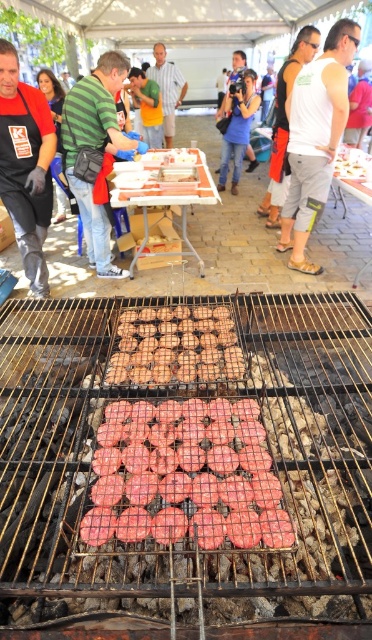
Question: Which point is closer to the camera?

Choices:
 (A) (159, 147)
 (B) (287, 100)
 (C) (78, 113)
 (D) (49, 193)

Answer: (C)

Question: Which point appears farthest from the camera in this image?

Choices:
 (A) (156, 52)
 (B) (245, 419)
 (C) (363, 160)
 (D) (315, 93)

Answer: (A)

Question: Among these points, which one is nearest to the camera?

Choices:
 (A) (245, 60)
 (B) (106, 273)
 (C) (351, 166)
 (D) (268, 176)

Answer: (B)

Question: Observing the image, what is the correct spatial positioning of brushed metal apron at left in reference to white matte tank top at center?

Choices:
 (A) below
 (B) above

Answer: (A)

Question: Is the position of green striped shirt at upper left more distant than that of white glossy plate at center?

Choices:
 (A) no
 (B) yes

Answer: (A)

Question: Can you confirm if green striped shirt at upper left is positioned below light brown shirt at center?

Choices:
 (A) no
 (B) yes

Answer: (B)